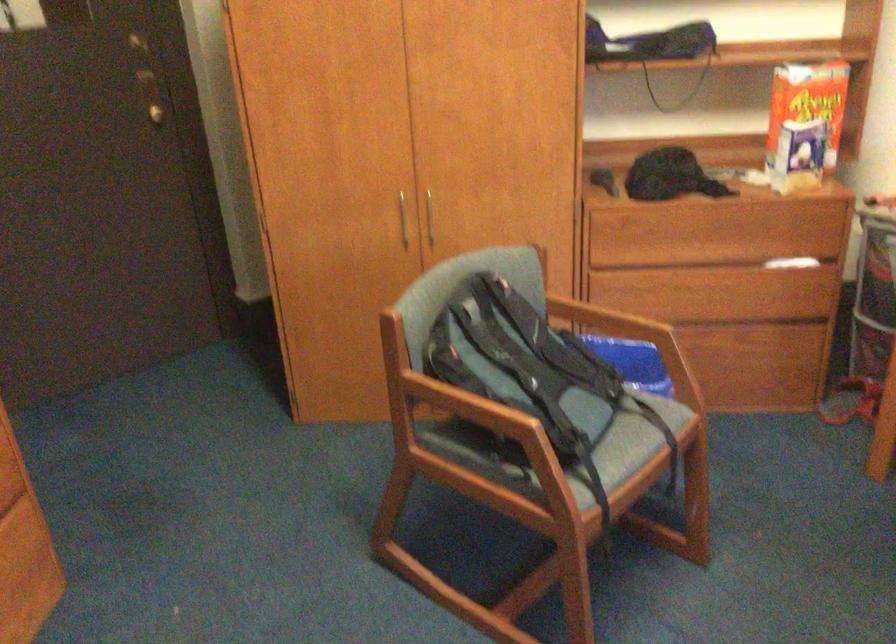
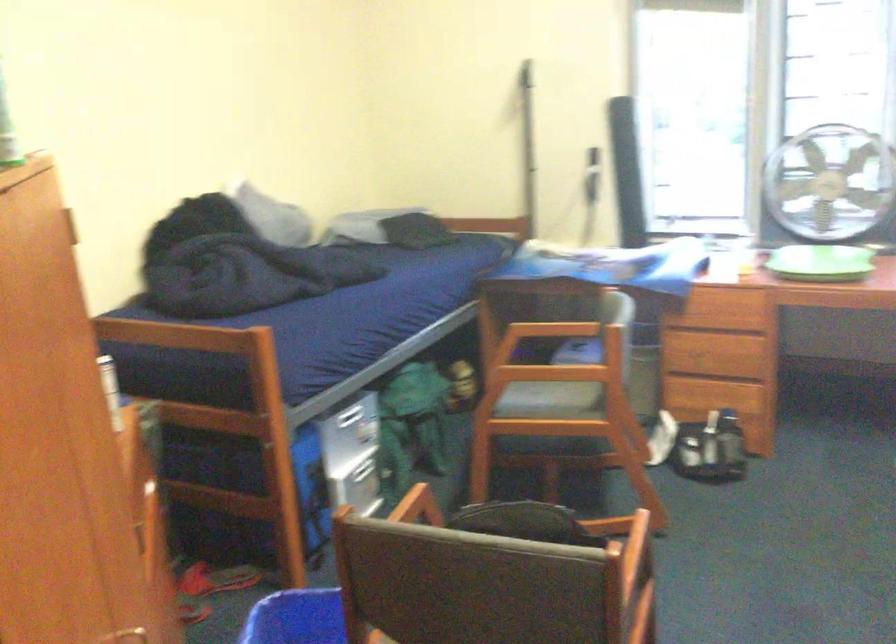
Question: I am providing you with two images of the same scene from different viewpoints. Please identify which objects are invisible in image2.

Choices:
 (A) dark chair seat
 (B) stack of white books
 (C) green circular tray
 (D) chair sitting surface

Answer: (D)